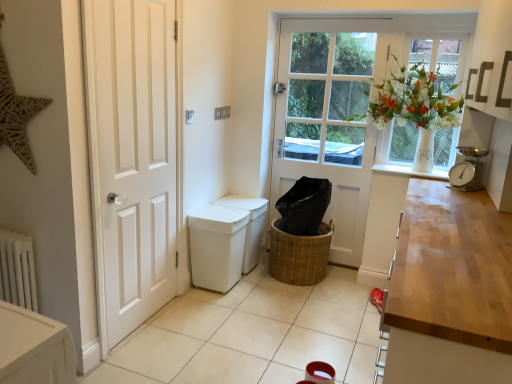
This screenshot has width=512, height=384. In order to click on free space above white tile at center (from a real-world perspective) in this screenshot , I will do `click(268, 324)`.